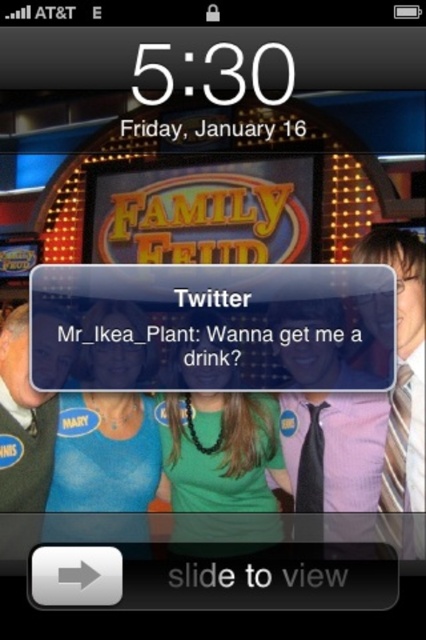
Who is positioned more to the right, pink fabric tie at right or striped tie at right?

From the viewer's perspective, striped tie at right appears more on the right side.

Does pink fabric tie at right have a lesser width compared to striped tie at right?

No, pink fabric tie at right is not thinner than striped tie at right.

Is point (293, 445) farther from viewer compared to point (403, 531)?

Yes, it is behind point (403, 531).

Identify the location of pink fabric tie at right. This screenshot has height=640, width=426. (333, 461).

Does green matte necklace at center have a larger size compared to striped tie at right?

Yes.

Can you confirm if green matte necklace at center is thinner than striped tie at right?

In fact, green matte necklace at center might be wider than striped tie at right.

Which is in front, point (233, 480) or point (409, 461)?

Point (409, 461) is in front.

Locate an element on the screen. This screenshot has height=640, width=426. green matte necklace at center is located at coordinates (221, 468).

Image resolution: width=426 pixels, height=640 pixels. Describe the element at coordinates (221, 468) in the screenshot. I see `green matte necklace at center` at that location.

Does green matte necklace at center have a lesser width compared to green matte shirt at center?

Incorrect, green matte necklace at center's width is not less than green matte shirt at center's.

Is point (204, 336) in front of point (152, 417)?

No, it is behind (152, 417).

The width and height of the screenshot is (426, 640). I want to click on green matte necklace at center, so click(x=221, y=468).